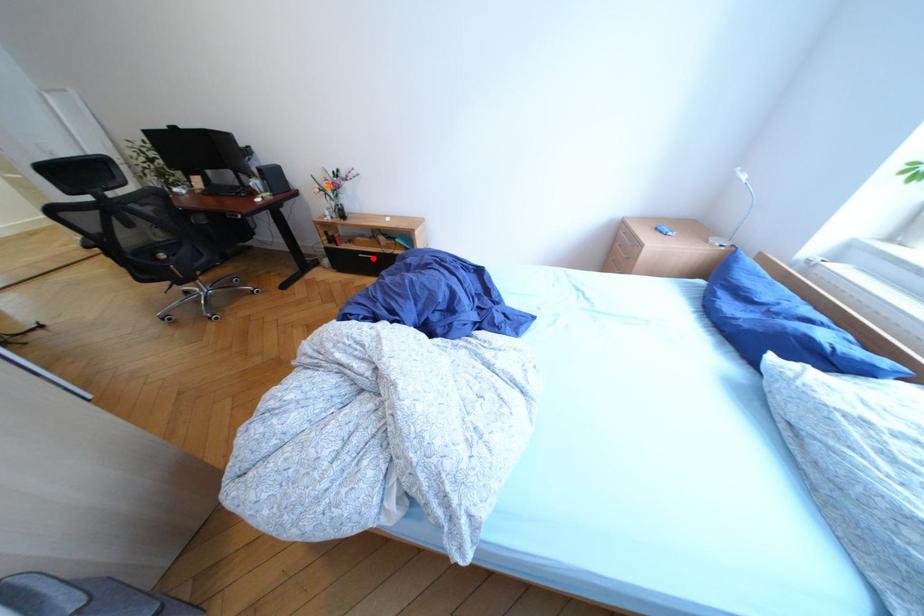
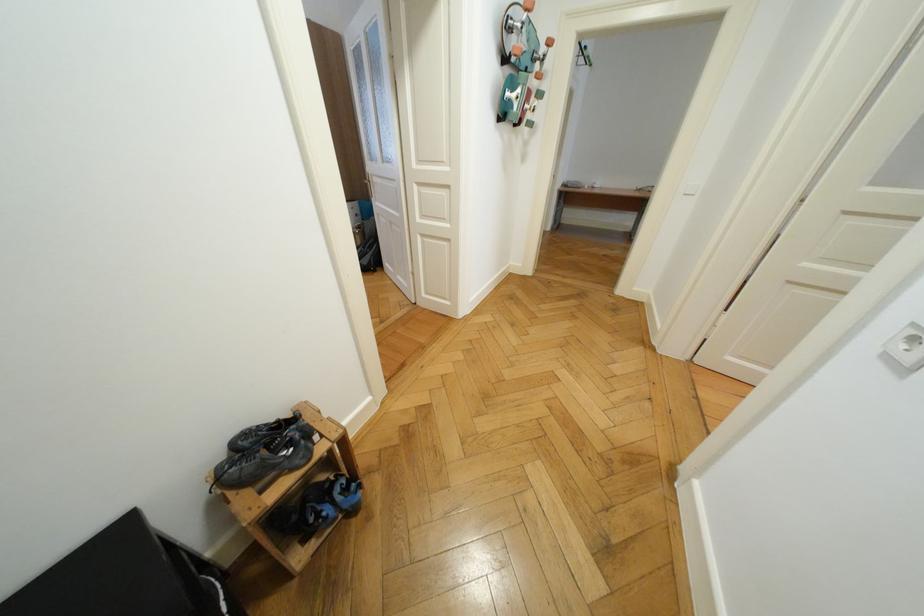
Question: I am providing you with two images of the same scene from different viewpoints. A red point is marked on the first image. Is the red point's position out of view in image 2?

Choices:
 (A) Yes
 (B) No

Answer: (A)